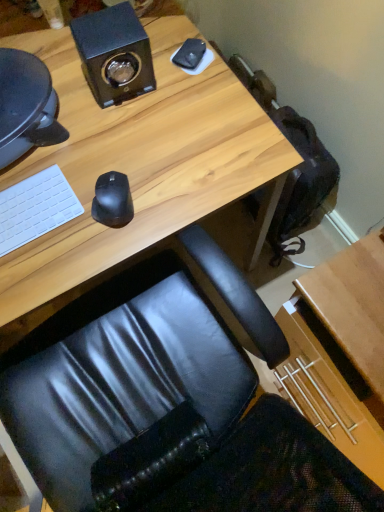
Question: Is black matte speaker at upper left at the right side of black matte mouse at center?

Choices:
 (A) yes
 (B) no

Answer: (B)

Question: From a real-world perspective, is black matte speaker at upper left on black matte mouse at center?

Choices:
 (A) yes
 (B) no

Answer: (A)

Question: From a real-world perspective, is black matte speaker at upper left located beneath black matte mouse at center?

Choices:
 (A) no
 (B) yes

Answer: (A)

Question: From the image's perspective, is black matte speaker at upper left beneath black matte mouse at center?

Choices:
 (A) yes
 (B) no

Answer: (B)

Question: Is black matte speaker at upper left not inside black matte mouse at center?

Choices:
 (A) yes
 (B) no

Answer: (A)

Question: Does black matte speaker at upper left appear on the left side of black matte mouse at center?

Choices:
 (A) yes
 (B) no

Answer: (A)

Question: From the image's perspective, does black matte mouse at center appear higher than black matte speaker at upper left?

Choices:
 (A) no
 (B) yes

Answer: (A)

Question: Is black matte mouse at center at the right side of black matte speaker at upper left?

Choices:
 (A) yes
 (B) no

Answer: (A)

Question: Is black matte mouse at center completely or partially outside of black matte speaker at upper left?

Choices:
 (A) yes
 (B) no

Answer: (A)

Question: From the image's perspective, does black matte mouse at center appear lower than black matte speaker at upper left?

Choices:
 (A) no
 (B) yes

Answer: (B)

Question: From a real-world perspective, is black matte mouse at center on top of black matte speaker at upper left?

Choices:
 (A) yes
 (B) no

Answer: (B)

Question: Considering the relative sizes of black matte mouse at center and black matte speaker at upper left in the image provided, is black matte mouse at center thinner than black matte speaker at upper left?

Choices:
 (A) no
 (B) yes

Answer: (B)

Question: Can we say wooden desk at center lies outside black matte speaker at upper left?

Choices:
 (A) no
 (B) yes

Answer: (B)